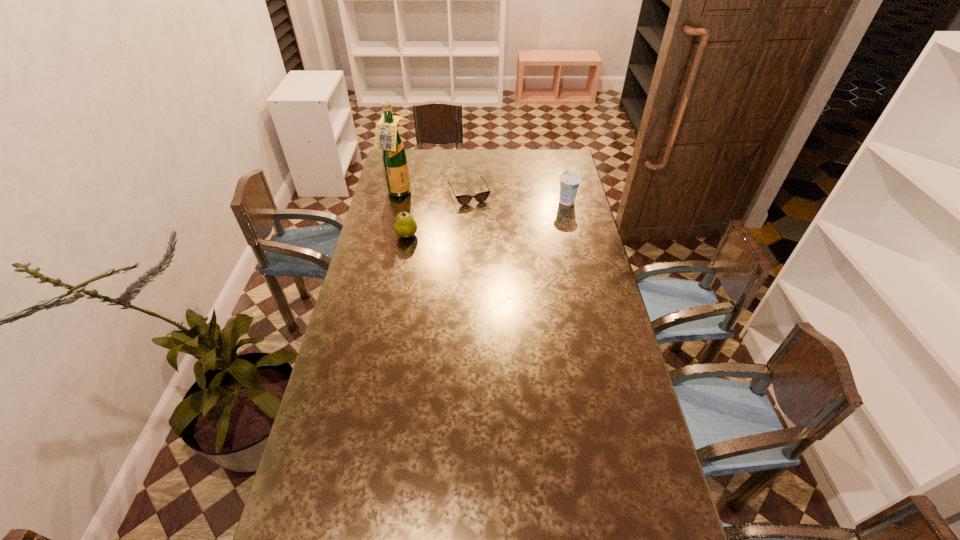
Find the location of `the nearest object`. the nearest object is located at coordinates (405, 226).

At what (x,y) coordinates should I click in order to perform the action: click on the rightmost object. Please return your answer as a coordinate pair (x, y). The width and height of the screenshot is (960, 540). Looking at the image, I should click on (569, 182).

You are a GUI agent. You are given a task and a screenshot of the screen. Output one action in this format:
    pyautogui.click(x=<x>, y=<y>)
    Task: Click on the tallest object
    
    Given the screenshot: What is the action you would take?
    pyautogui.click(x=394, y=157)

Find the location of a particular element. The height and width of the screenshot is (540, 960). sunglasses is located at coordinates (480, 197).

The image size is (960, 540). Find the location of `the shortest object`. the shortest object is located at coordinates (480, 197).

Where is `vacant position located on the right of the nearest object`? The width and height of the screenshot is (960, 540). vacant position located on the right of the nearest object is located at coordinates (459, 235).

Find the location of a particular element. This screenshot has height=540, width=960. free location located on the left of the rightmost object is located at coordinates (525, 200).

Locate an element on the screen. The image size is (960, 540). vacant area situated on the front-facing side of the liquor is located at coordinates (437, 209).

At what (x,y) coordinates should I click in order to perform the action: click on blank area located on the front-facing side of the liquor. Please return your answer as a coordinate pair (x, y). Looking at the image, I should click on (466, 220).

What are the coordinates of `vacant space located on the front-facing side of the liquor` in the screenshot? It's located at (483, 227).